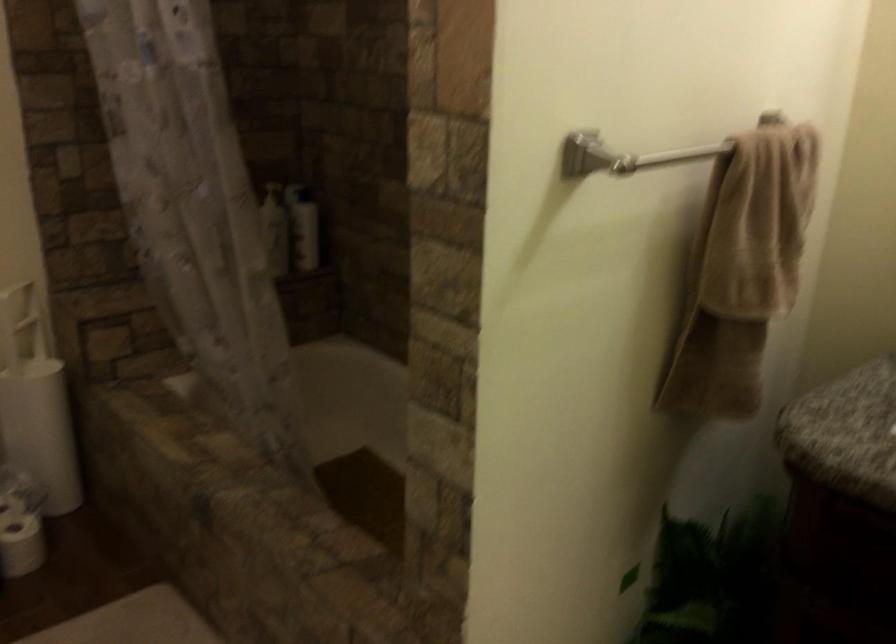
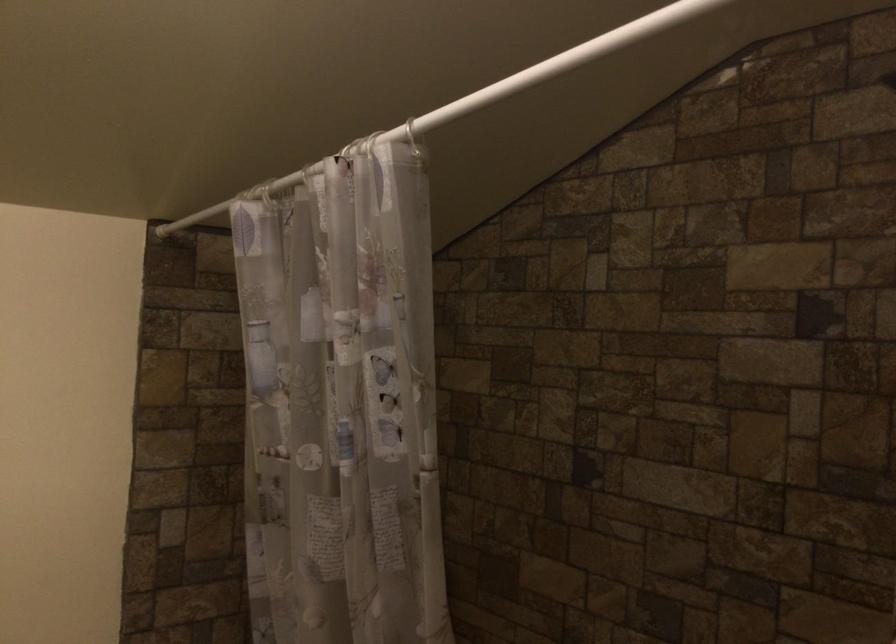
The images are taken continuously from a first-person perspective. In which direction are you moving?

The cameraman moved toward left, forward.